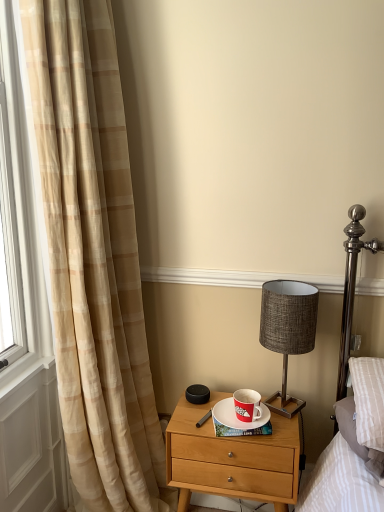
You are a GUI agent. You are given a task and a screenshot of the screen. Output one action in this format:
    pyautogui.click(x=<x>, y=<y>)
    Task: Click on the free region on the left part of white ceramic saucer at center
    This screenshot has height=512, width=384.
    Given the screenshot: What is the action you would take?
    pyautogui.click(x=198, y=412)